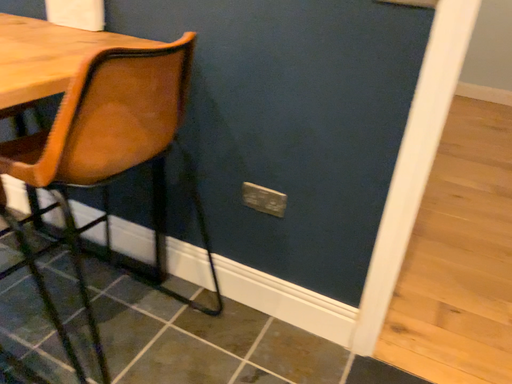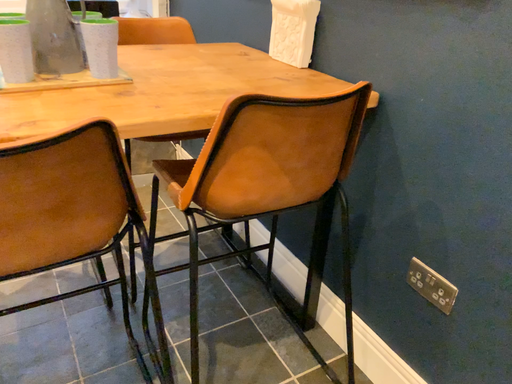
Question: Which way did the camera rotate in the video?

Choices:
 (A) rotated left
 (B) rotated right

Answer: (A)